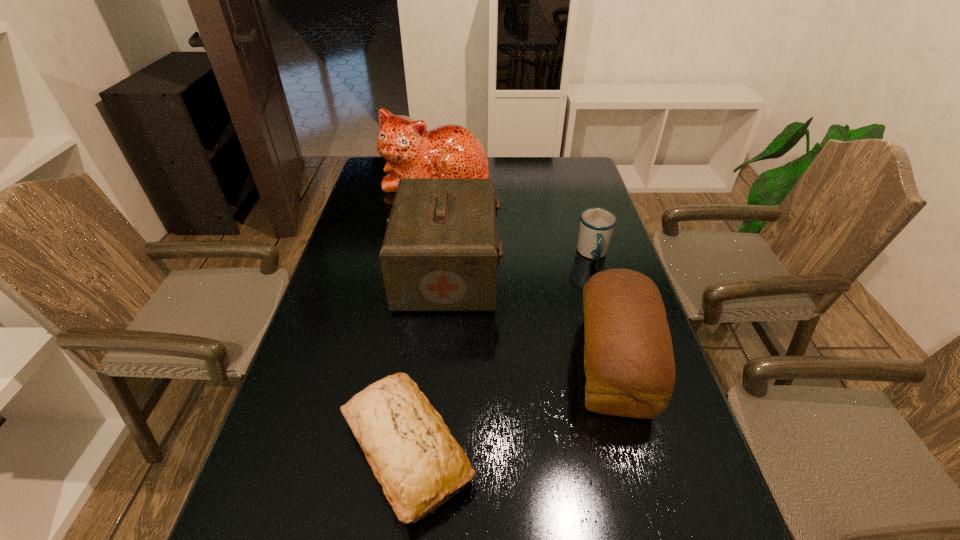
Identify the location of vacant area situated on the right of the shorter bread. This screenshot has width=960, height=540. (546, 449).

Locate an element on the screen. Image resolution: width=960 pixels, height=540 pixels. object at the far edge is located at coordinates (449, 151).

This screenshot has height=540, width=960. I want to click on cat located in the left edge section of the desktop, so click(449, 151).

Locate an element on the screen. The height and width of the screenshot is (540, 960). bread located at the left edge is located at coordinates 413,455.

The image size is (960, 540). Identify the location of bread present at the right edge. (629, 363).

Where is `mug located in the right edge section of the desktop`? Image resolution: width=960 pixels, height=540 pixels. mug located in the right edge section of the desktop is located at coordinates (596, 224).

Find the location of a particular element. The width and height of the screenshot is (960, 540). object that is at the far left corner is located at coordinates (449, 151).

Identify the location of vacant region at the far edge. (520, 176).

This screenshot has height=540, width=960. In order to click on blank space at the left edge in this screenshot , I will do `click(316, 321)`.

Find the location of a particular element. Image resolution: width=960 pixels, height=540 pixels. vacant area at the right edge is located at coordinates (616, 418).